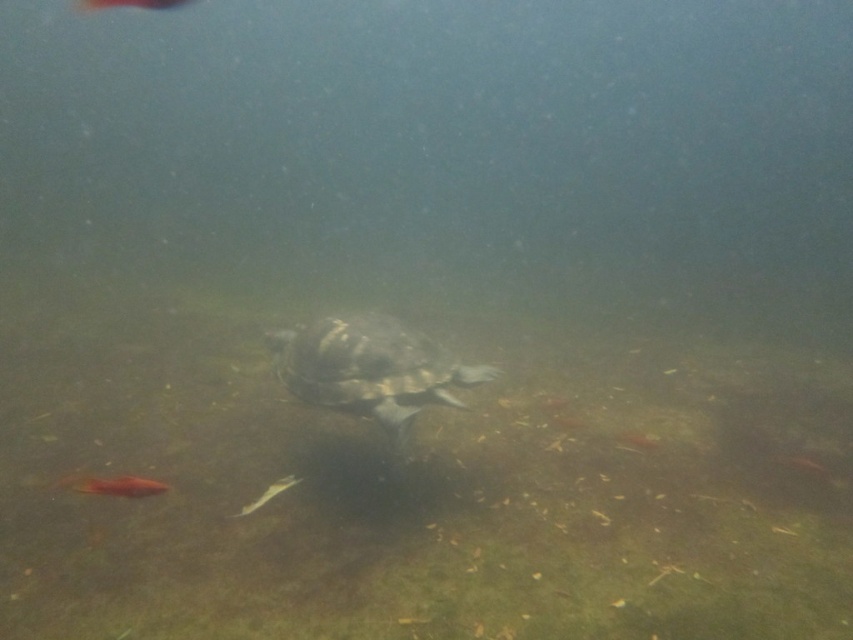
Does translucent orange fish at center have a greater width compared to shiny orange fish at center?

No, translucent orange fish at center is not wider than shiny orange fish at center.

Describe the element at coordinates (120, 486) in the screenshot. I see `translucent orange fish at center` at that location.

What do you see at coordinates (120, 486) in the screenshot?
I see `translucent orange fish at center` at bounding box center [120, 486].

Image resolution: width=853 pixels, height=640 pixels. What are the coordinates of `translucent orange fish at center` in the screenshot? It's located at (120, 486).

Can you confirm if brown textured shell at center is smaller than translucent orange fish at center?

Incorrect, brown textured shell at center is not smaller in size than translucent orange fish at center.

Does brown textured shell at center appear on the left side of translucent orange fish at center?

In fact, brown textured shell at center is to the right of translucent orange fish at center.

Who is more forward, (314, 371) or (126, 492)?

Point (126, 492)

You are a GUI agent. You are given a task and a screenshot of the screen. Output one action in this format:
    pyautogui.click(x=<x>, y=<y>)
    Task: Click on the brown textured shell at center
    
    Given the screenshot: What is the action you would take?
    pyautogui.click(x=370, y=368)

This screenshot has height=640, width=853. I want to click on brown textured shell at center, so click(370, 368).

In the scene shown: Who is positioned more to the right, brown textured shell at center or shiny orange fish at center?

From the viewer's perspective, brown textured shell at center appears more on the right side.

Is point (395, 368) positioned before point (125, 4)?

Yes, point (395, 368) is closer to viewer.

Locate an element on the screen. brown textured shell at center is located at coordinates (370, 368).